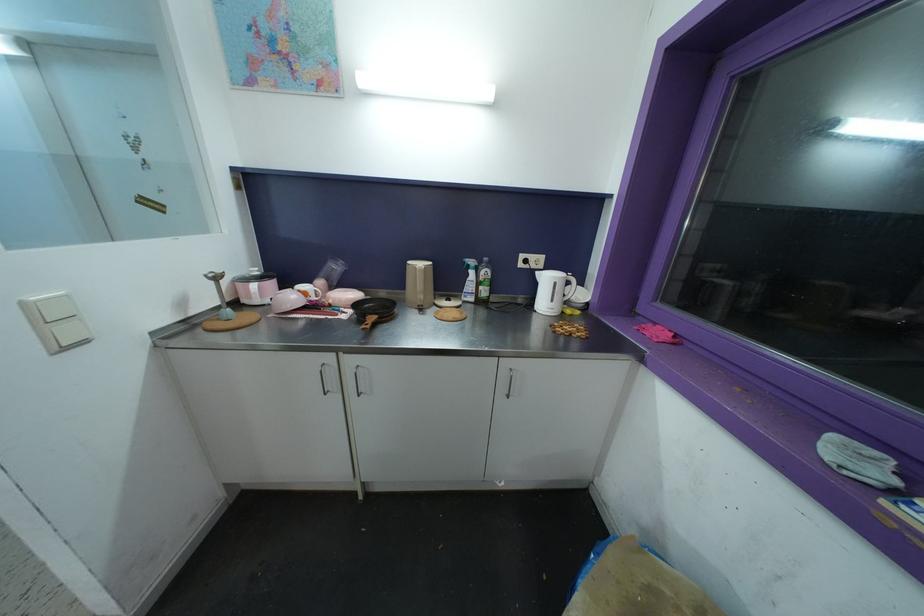
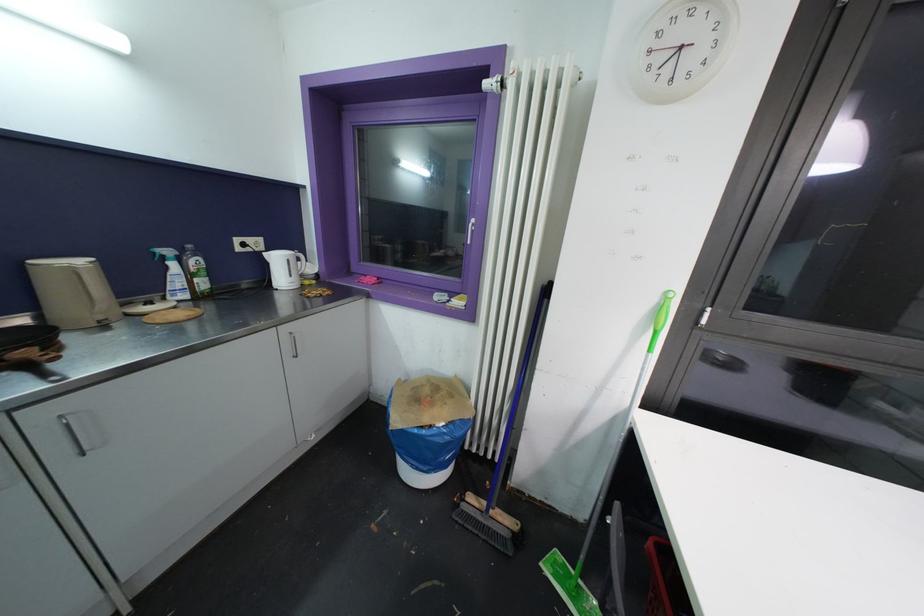
The point at (475, 275) is marked in the first image. Where is the corresponding point in the second image?

(176, 267)